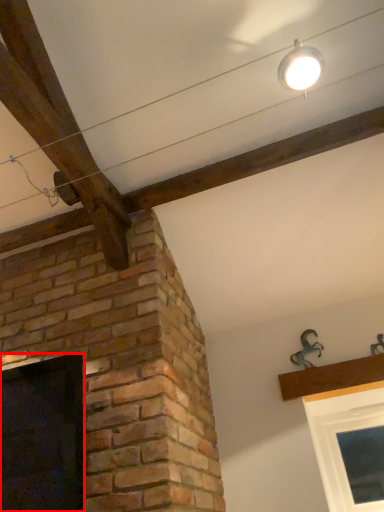
Question: Observing the image, what is the correct spatial positioning of window (annotated by the red box) in reference to light fixture?

Choices:
 (A) left
 (B) right

Answer: (A)